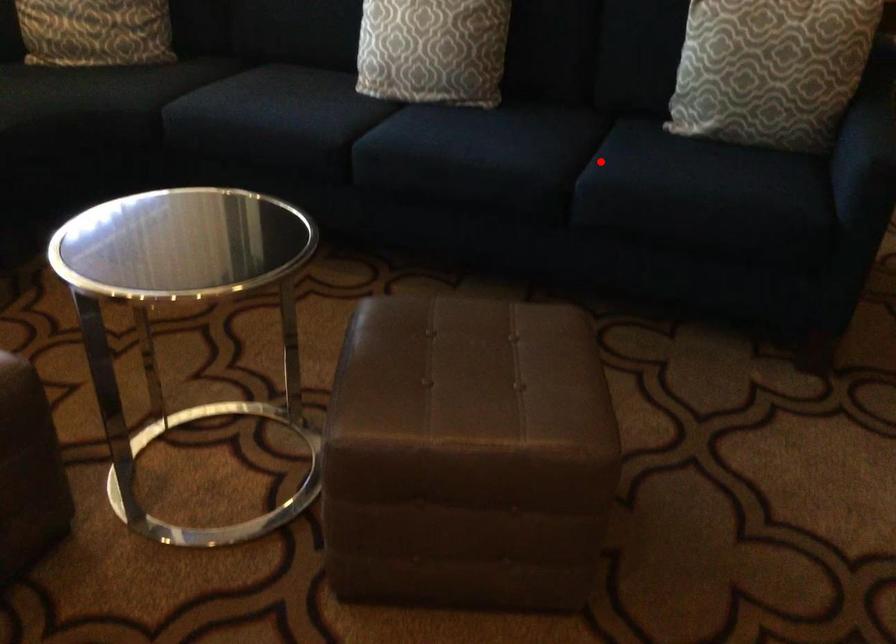
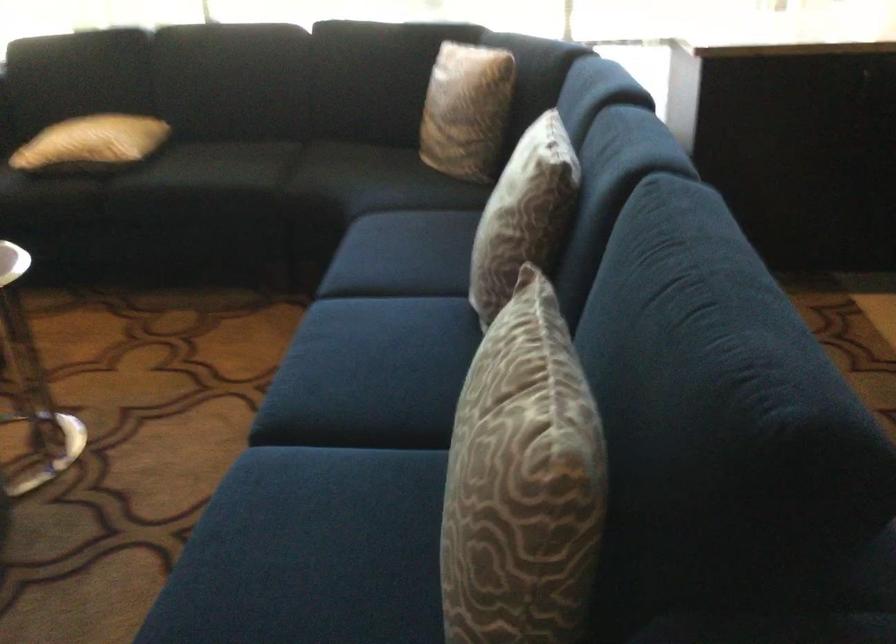
Question: I am providing you with two images of the same scene from different viewpoints. Given a red point in image1, look at the same physical point in image2. Is it:

Choices:
 (A) Closer to the viewpoint
 (B) Farther from the viewpoint

Answer: (A)